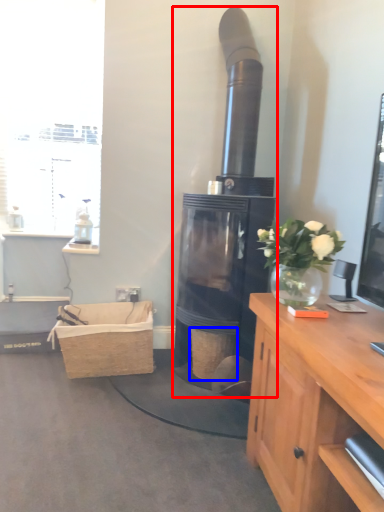
Question: Among these objects, which one is nearest to the camera, fireplace (highlighted by a red box) or basket (highlighted by a blue box)?

Choices:
 (A) fireplace
 (B) basket

Answer: (A)